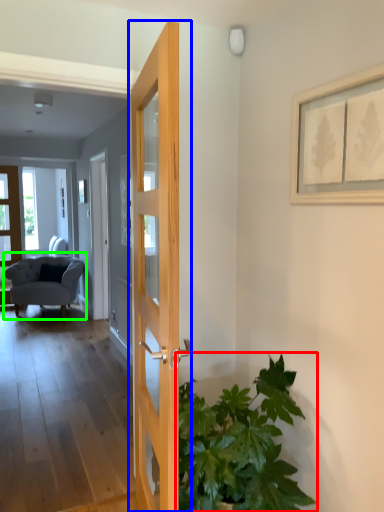
Question: Which is farther away from houseplant (highlighted by a red box)? door (highlighted by a blue box) or chair (highlighted by a green box)?

Choices:
 (A) door
 (B) chair

Answer: (B)